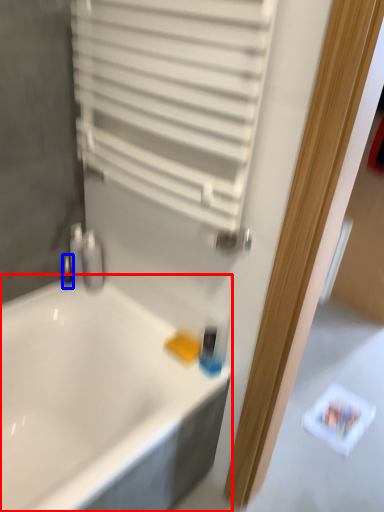
Question: Which object appears farthest to the camera in this image, bathtub (highlighted by a red box) or toiletry (highlighted by a blue box)?

Choices:
 (A) bathtub
 (B) toiletry

Answer: (B)